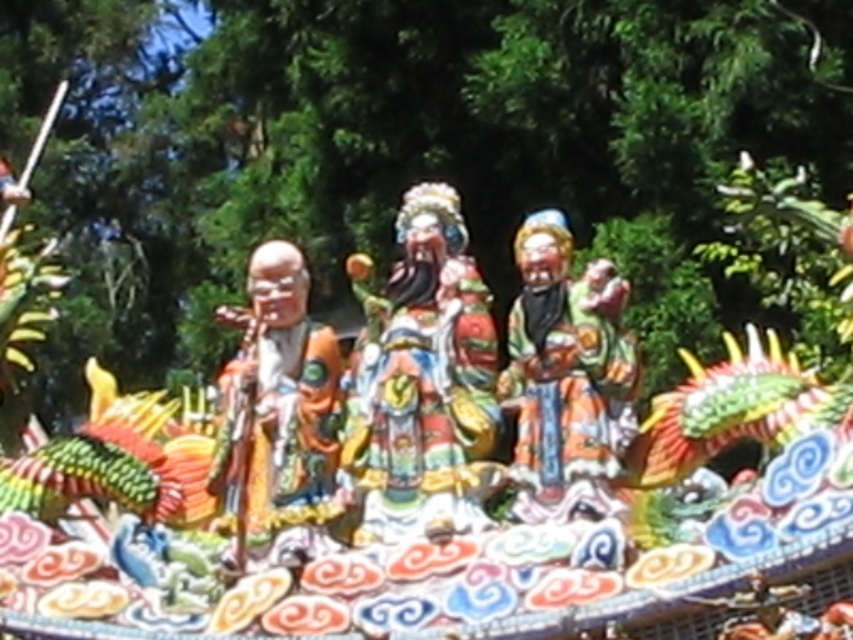
Does multicolored glossy statue at center appear under matte orange robe at left?

Correct, multicolored glossy statue at center is located below matte orange robe at left.

Can you confirm if multicolored glossy statue at center is wider than matte orange robe at left?

Incorrect, multicolored glossy statue at center's width does not surpass matte orange robe at left's.

The image size is (853, 640). I want to click on multicolored glossy statue at center, so click(422, 381).

Where is `multicolored glossy statue at center`? The height and width of the screenshot is (640, 853). multicolored glossy statue at center is located at coordinates (422, 381).

Does multicolored glossy statue at center have a larger size compared to matte painted figure at center?

Correct, multicolored glossy statue at center is larger in size than matte painted figure at center.

Measure the distance between multicolored glossy statue at center and camera.

multicolored glossy statue at center is 231.11 feet away from camera.

Identify the location of multicolored glossy statue at center. (422, 381).

Based on the photo, who is positioned more to the right, matte orange robe at left or matte painted figure at center?

→ matte painted figure at center

Measure the distance from matte orange robe at left to matte painted figure at center.

matte orange robe at left and matte painted figure at center are 12.31 meters apart.

This screenshot has width=853, height=640. Describe the element at coordinates (277, 420) in the screenshot. I see `matte orange robe at left` at that location.

You are a GUI agent. You are given a task and a screenshot of the screen. Output one action in this format:
    pyautogui.click(x=<x>, y=<y>)
    Task: Click on the matte orange robe at left
    The height and width of the screenshot is (640, 853).
    Given the screenshot: What is the action you would take?
    277,420